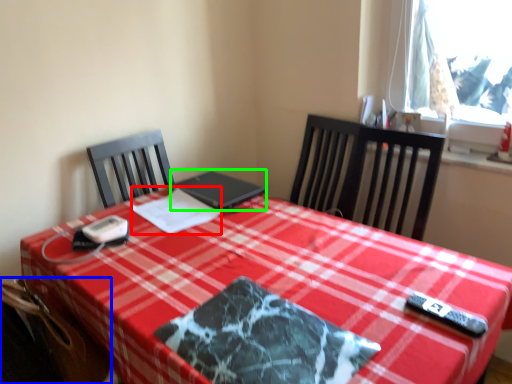
Question: Which object is positioned closest to linen (highlighted by a red box)? Select from swivel chair (highlighted by a blue box) and laptop (highlighted by a green box).

Choices:
 (A) swivel chair
 (B) laptop

Answer: (B)